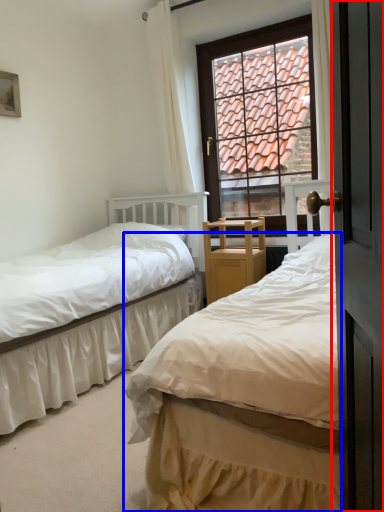
Question: Which object is further to the camera taking this photo, screen door (highlighted by a red box) or bed (highlighted by a blue box)?

Choices:
 (A) screen door
 (B) bed

Answer: (B)